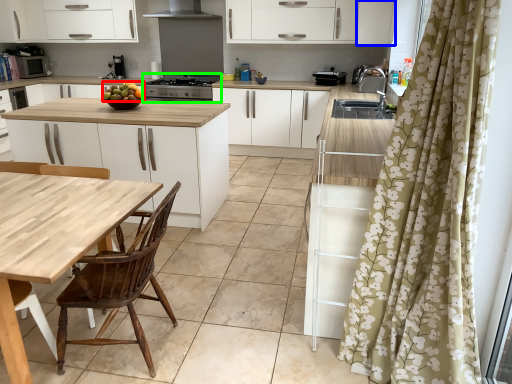
Question: Which object is positioned farthest from fruit (highlighted by a red box)? Select from cabinetry (highlighted by a blue box) and kitchen appliance (highlighted by a green box).

Choices:
 (A) cabinetry
 (B) kitchen appliance

Answer: (A)